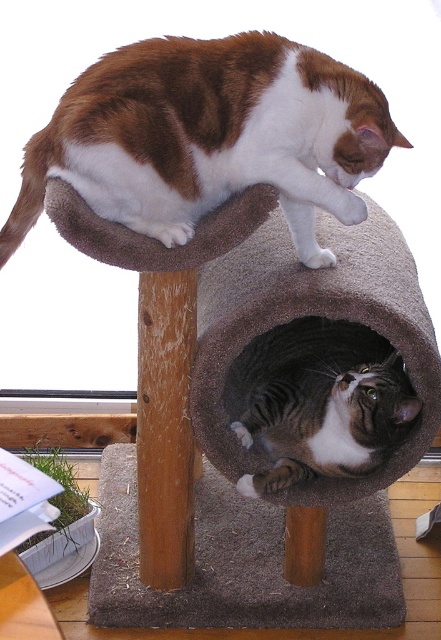
You are a cat owner who wants to ensure your cats have enough space to rest comfortably. Given the gray carpeted cat bed at center and the gray striped cat at lower center, which object is wider?

The gray carpeted cat bed at center is wider than the gray striped cat at lower center.